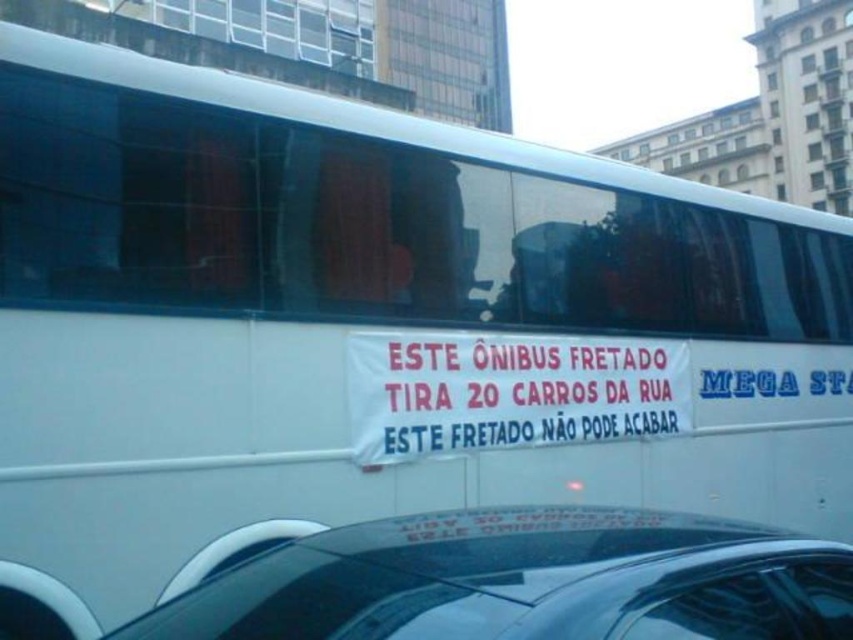
Is point (711, 611) closer to camera compared to point (552, 385)?

Yes, it is.

Which is in front, point (583, 509) or point (682, 397)?

Point (583, 509) is more forward.

The width and height of the screenshot is (853, 640). I want to click on black glossy car at lower center, so click(x=524, y=580).